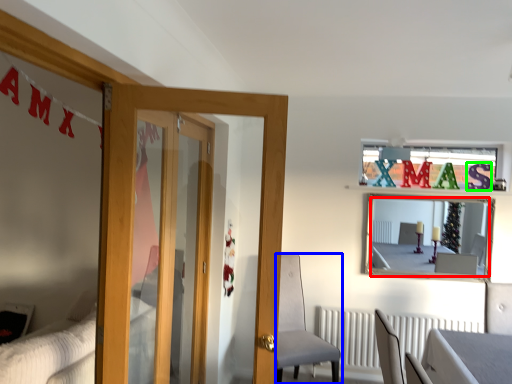
Question: Based on their relative distances, which object is farther from mirror (highlighted by a red box)? Choose from chair (highlighted by a blue box) and letter (highlighted by a green box).

Choices:
 (A) chair
 (B) letter

Answer: (A)